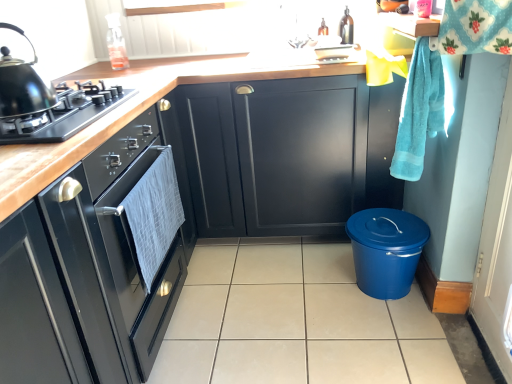
The image size is (512, 384). In order to click on free point above matte black cabinet at center, arranged as the 1th cabinetry when viewed from the back (from a real-world perspective) in this screenshot , I will do `click(260, 59)`.